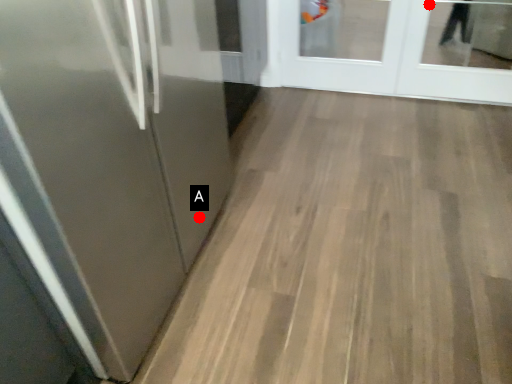
Question: Two points are circled on the image, labeled by A and B beside each circle. Which point is closer to the camera taking this photo?

Choices:
 (A) A is closer
 (B) B is closer

Answer: (A)